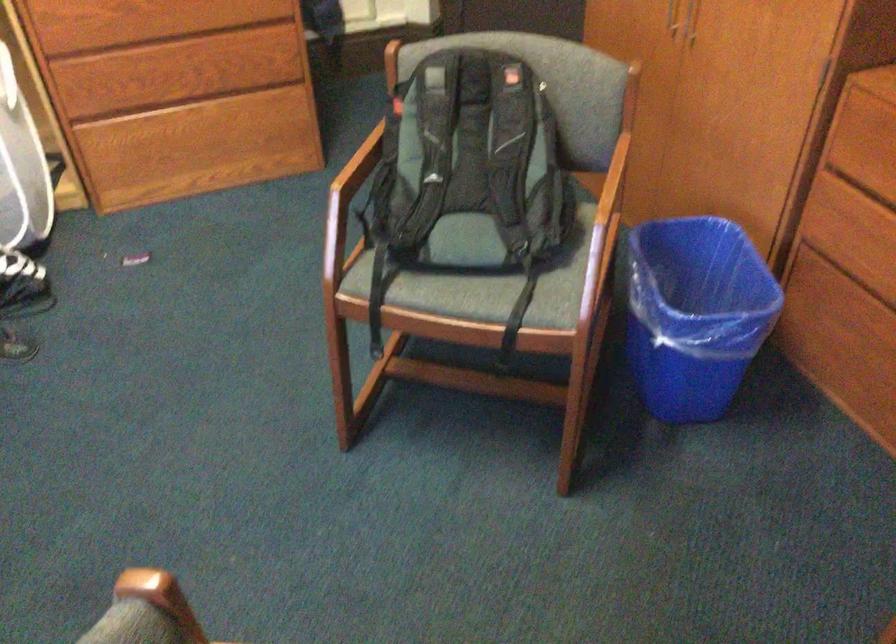
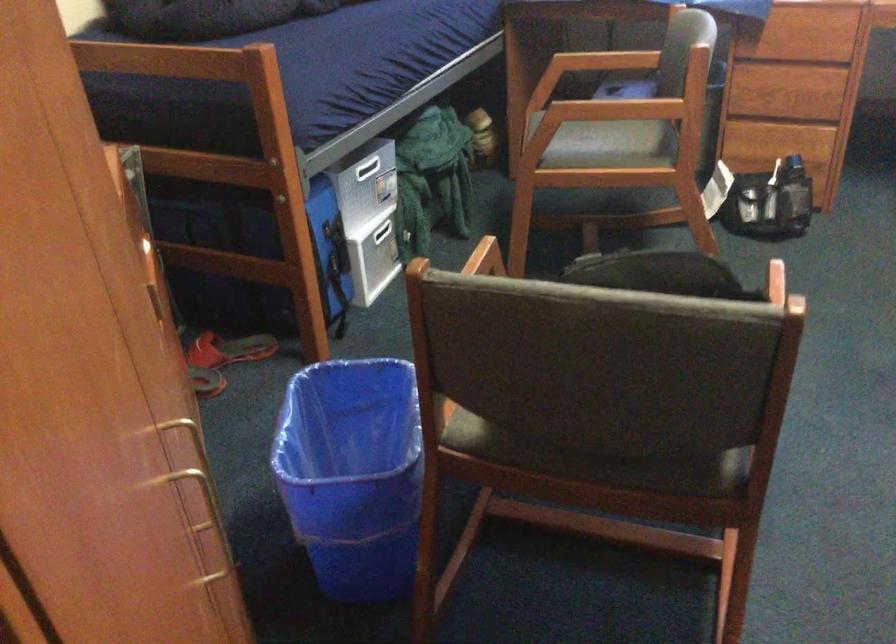
The point at (502,228) is marked in the first image. Where is the corresponding point in the second image?

(561, 460)